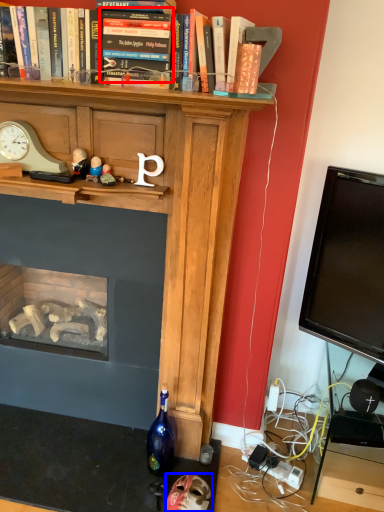
Question: Which object appears farthest to the camera in this image, book (highlighted by a red box) or toy (highlighted by a blue box)?

Choices:
 (A) book
 (B) toy

Answer: (B)